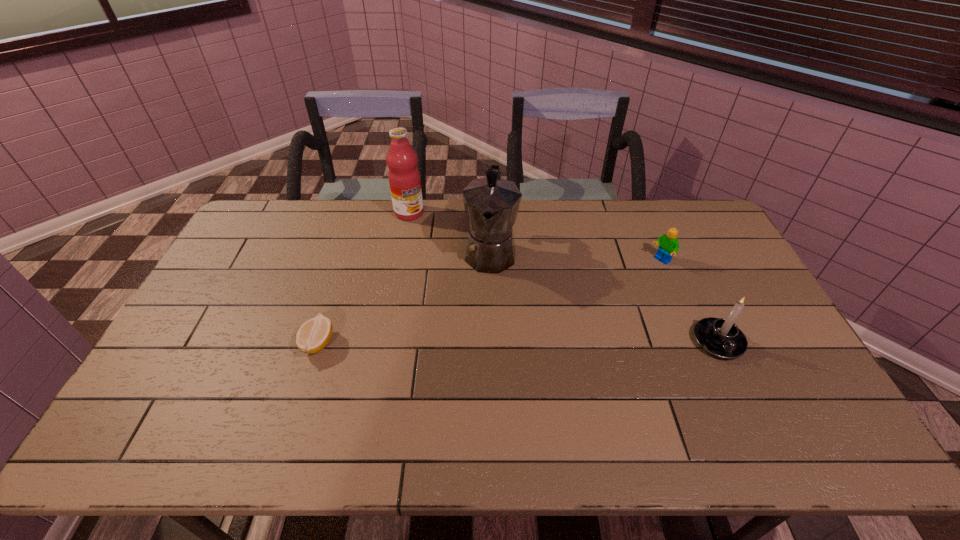
This screenshot has width=960, height=540. I want to click on vacant spot on the desktop that is between the lemon and the third shortest object and is positioned on the pouring side of the coffeepot, so click(x=478, y=342).

The image size is (960, 540). What are the coordinates of `free space on the desktop that is between the shortest object and the candle holder and is positioned on the face of the second shortest object` in the screenshot? It's located at (551, 342).

In order to click on vacant space on the desktop that is between the lemon and the candle holder and is positioned on the label of the second object from left to right in this screenshot , I will do `click(498, 342)`.